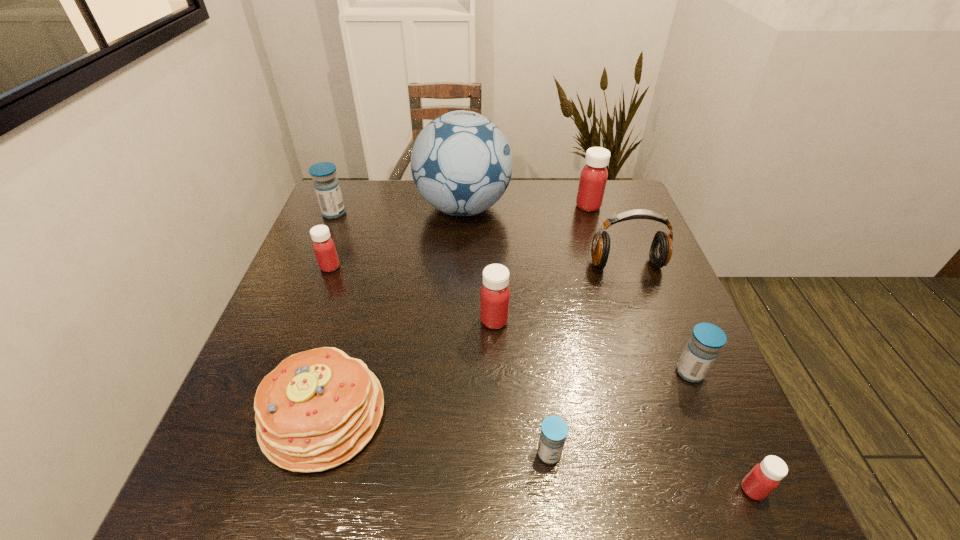
Identify the location of pancake that is at the left edge. pos(317,409).

Image resolution: width=960 pixels, height=540 pixels. In order to click on headset positioned at the right edge in this screenshot , I will do `click(661, 249)`.

Where is `object that is at the far left corner`? The height and width of the screenshot is (540, 960). object that is at the far left corner is located at coordinates (327, 188).

What are the coordinates of `object present at the near left corner` in the screenshot? It's located at (317, 409).

The height and width of the screenshot is (540, 960). In order to click on object located at the far right corner in this screenshot , I will do `click(593, 178)`.

Find the location of a particular element. This screenshot has width=960, height=540. object located at the near right corner is located at coordinates (766, 476).

Locate an element on the screen. This screenshot has height=540, width=960. free space at the far edge of the desktop is located at coordinates (508, 191).

The height and width of the screenshot is (540, 960). What are the coordinates of `vacant space at the near edge` in the screenshot? It's located at (482, 502).

I want to click on vacant area at the left edge of the desktop, so click(318, 328).

Identify the location of vacant space at the right edge of the desktop. This screenshot has height=540, width=960. (649, 270).